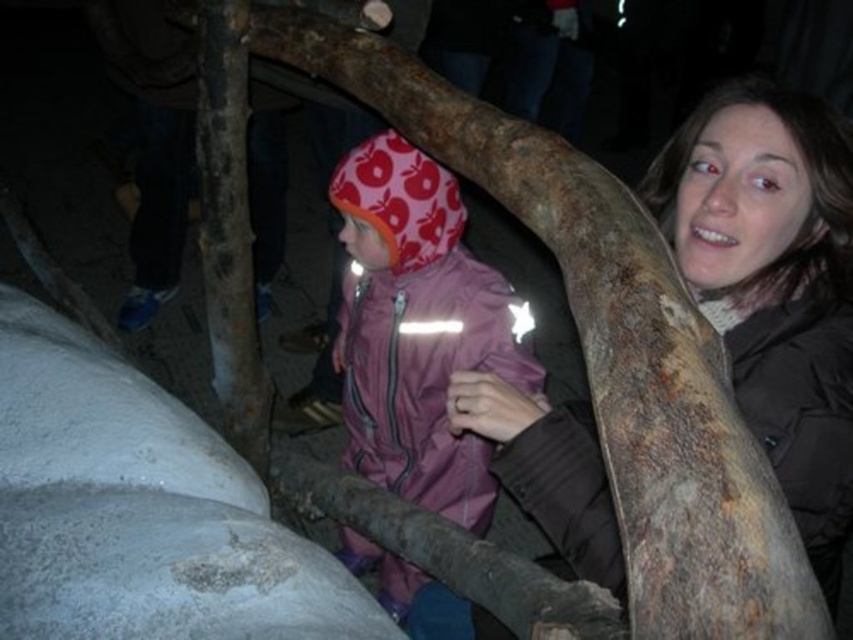
Question: Which of the following is the closest to the observer?

Choices:
 (A) (405, 593)
 (B) (563, 452)

Answer: (B)

Question: Is the position of matte brown jacket at right more distant than that of pink fabric jacket at center?

Choices:
 (A) no
 (B) yes

Answer: (A)

Question: Is matte brown jacket at right thinner than rusty wood tree trunk at center?

Choices:
 (A) yes
 (B) no

Answer: (B)

Question: Which object is closer to the camera taking this photo?

Choices:
 (A) pink fabric jacket at center
 (B) rusty wood tree trunk at center

Answer: (B)

Question: Which object is farther from the camera taking this photo?

Choices:
 (A) pink fabric jacket at center
 (B) matte brown jacket at right
 (C) rusty wood tree trunk at center

Answer: (A)

Question: Is matte brown jacket at right in front of rusty wood tree trunk at center?

Choices:
 (A) yes
 (B) no

Answer: (A)